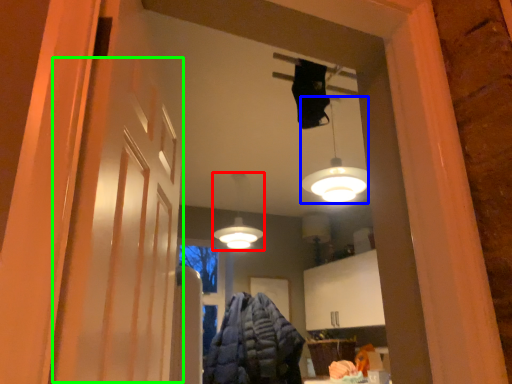
Question: Estimate the real-world distances between objects in this image. Which object is closer to lamp (highlighted by a red box), lamp (highlighted by a blue box) or barn door (highlighted by a green box)?

Choices:
 (A) lamp
 (B) barn door

Answer: (A)